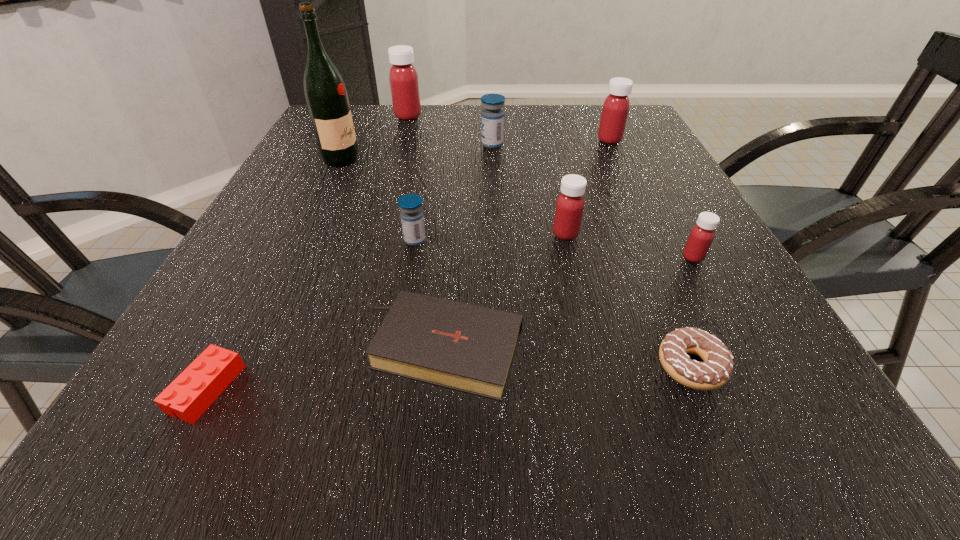
The width and height of the screenshot is (960, 540). I want to click on empty space that is in between the fourth medicine from right to left and the doughnut, so click(591, 255).

Where is `empty space between the red Lego and the Bible`? This screenshot has height=540, width=960. empty space between the red Lego and the Bible is located at coordinates (325, 369).

You are a GUI agent. You are given a task and a screenshot of the screen. Output one action in this format:
    pyautogui.click(x=<x>, y=<y>)
    Task: Click on the free space between the third medicine from right to left and the chocolate doughnut
    The image size is (960, 540).
    Given the screenshot: What is the action you would take?
    pyautogui.click(x=629, y=300)

Where is `vacant space that's between the second farthest red medicine and the bigger blue medicine`? vacant space that's between the second farthest red medicine and the bigger blue medicine is located at coordinates (551, 142).

Locate an element on the screen. free area in between the Bible and the fifth shortest medicine is located at coordinates [x=526, y=245].

Identify the location of free space between the farther blue medicine and the seventh object from left to right. (529, 190).

This screenshot has width=960, height=540. Identify the location of unoccupied position between the second biggest red medicine and the nearest medicine. (651, 199).

Locate an element on the screen. empty location between the green liquor and the left blue medicine is located at coordinates (378, 200).

Identify the location of free space between the leftmost medicine and the bigger blue medicine. (450, 130).

Locate an element on the screen. the third closest object to the doughnut is located at coordinates (570, 203).